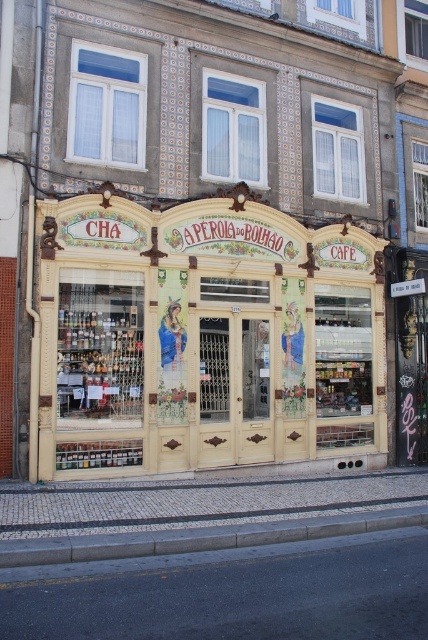
Looking at this image, can you confirm if yellow painted wood storefront at center is positioned to the left of gray concrete curb at lower center?

Yes, yellow painted wood storefront at center is to the left of gray concrete curb at lower center.

Can you confirm if yellow painted wood storefront at center is smaller than gray concrete curb at lower center?

Yes.

Is point (133, 392) behind point (267, 534)?

Yes, point (133, 392) is farther from viewer.

In order to click on yellow painted wood storefront at center in this screenshot , I will do `click(205, 333)`.